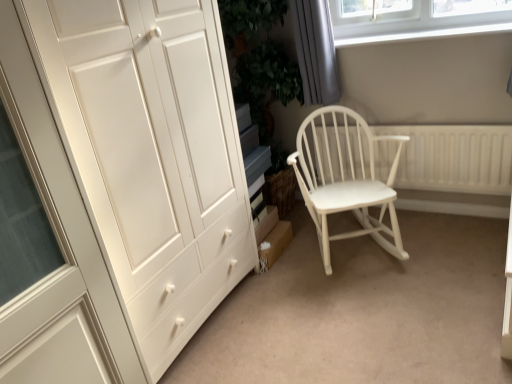
At what (x,y) coordinates should I click in order to perform the action: click on blank area beneath white wood rocking chair at center (from a real-world perspective). Please return your answer as a coordinate pair (x, y). This screenshot has width=512, height=384. Looking at the image, I should click on (352, 248).